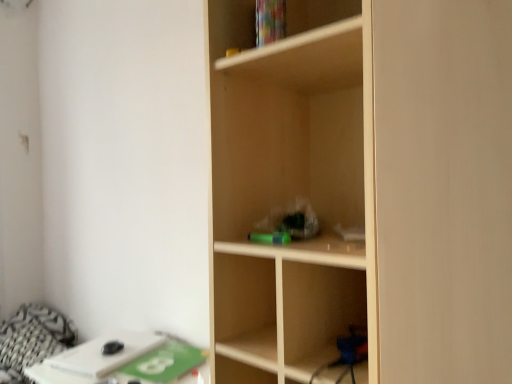
The image size is (512, 384). Find the location of `free spot above white matte table at lower left (from a real-world perspective)`. free spot above white matte table at lower left (from a real-world perspective) is located at coordinates (99, 350).